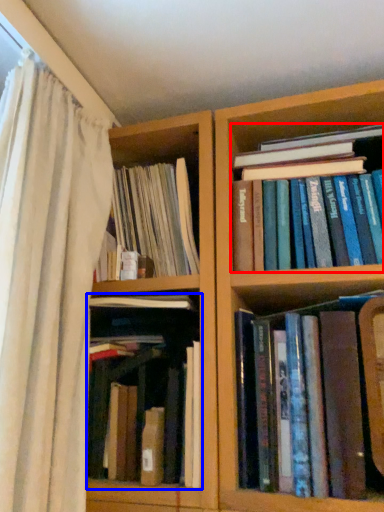
Question: Which point is closer to the camera, book (highlighted by a red box) or book (highlighted by a blue box)?

Choices:
 (A) book
 (B) book

Answer: (B)